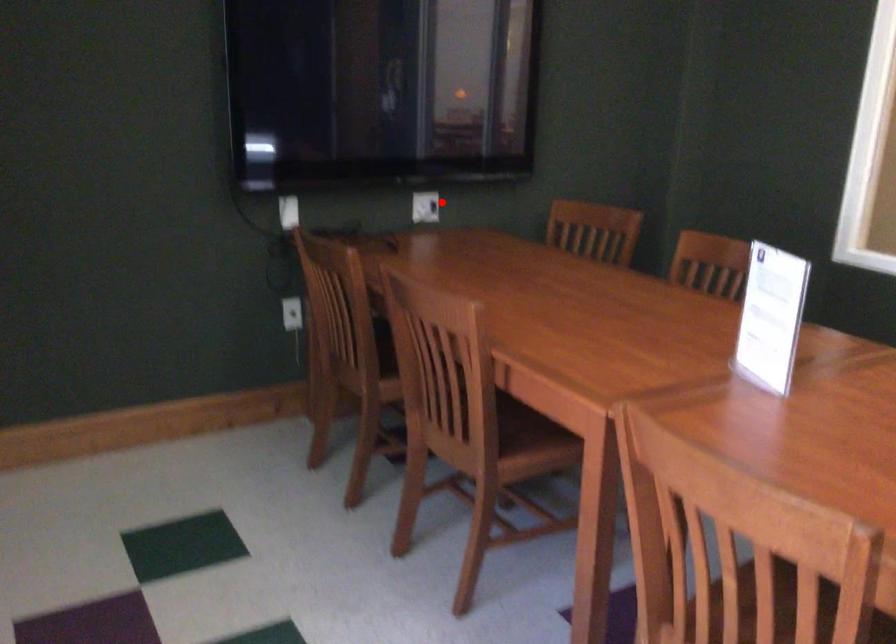
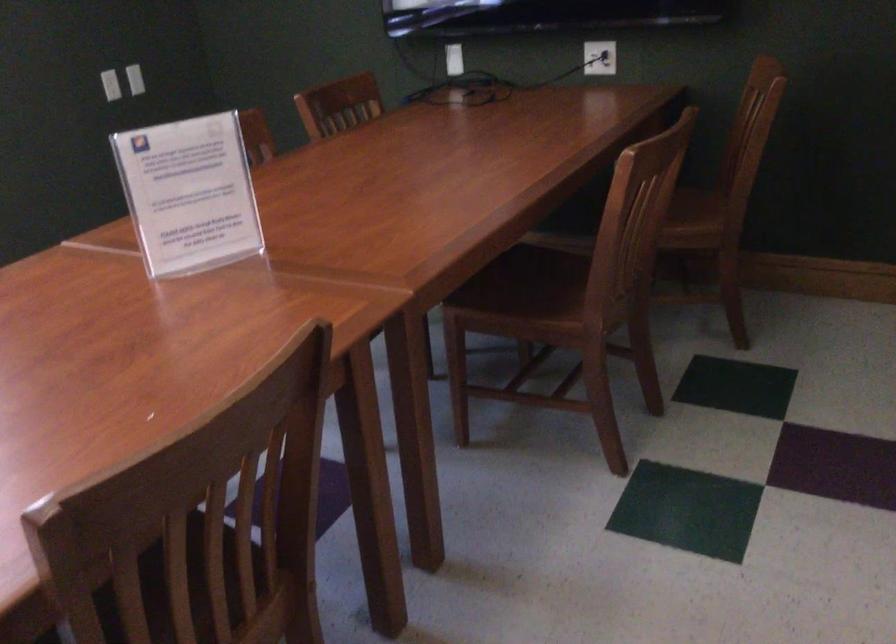
Question: I am providing you with two images of the same scene from different viewpoints. A red point is shown in image1. For the corresponding object point in image2, is it positioned nearer or farther from the camera?

Choices:
 (A) Nearer
 (B) Farther

Answer: (A)